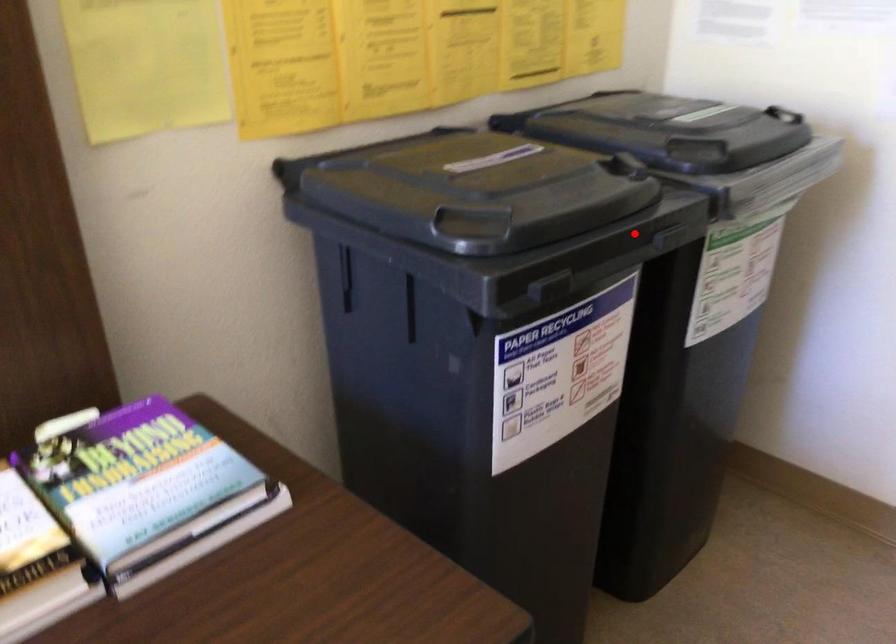
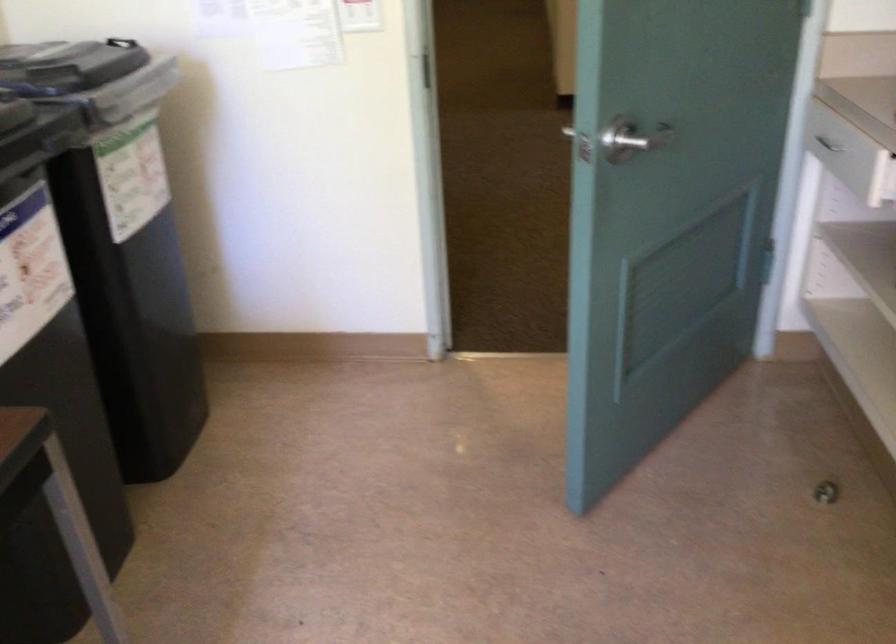
Question: I am providing you with two images of the same scene from different viewpoints. A red point is marked on the first image. At the location where the point appears in image 1, is it still visible in image 2?

Choices:
 (A) Yes
 (B) No

Answer: (A)